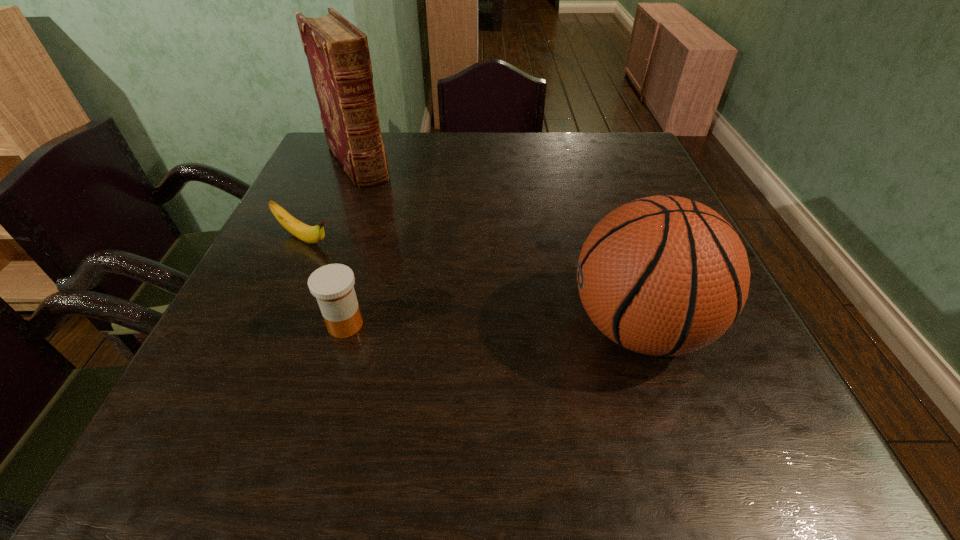
What are the coordinates of `vacant space located on the side where the inflation valve is located` in the screenshot? It's located at (447, 327).

I want to click on free point located on the spine side of the tallest object, so click(375, 196).

This screenshot has width=960, height=540. What are the coordinates of `free spot located 0.300m on the spine side of the tallest object` in the screenshot? It's located at (414, 249).

This screenshot has width=960, height=540. In order to click on free space located on the spine side of the tallest object in this screenshot , I will do `click(423, 263)`.

You are a GUI agent. You are given a task and a screenshot of the screen. Output one action in this format:
    pyautogui.click(x=<x>, y=<y>)
    Task: Click on the vacant space located at the stem of the shortest object
    
    Given the screenshot: What is the action you would take?
    pyautogui.click(x=367, y=266)

Find the location of `free region located 0.070m at the stem of the shortest object`. free region located 0.070m at the stem of the shortest object is located at coordinates tap(352, 259).

The image size is (960, 540). What are the coordinates of `vacant region located at the stem of the shortest object` in the screenshot? It's located at (356, 261).

Locate an element on the screen. This screenshot has height=540, width=960. object located at the far edge is located at coordinates (338, 56).

This screenshot has width=960, height=540. Identify the location of object present at the near edge. (663, 275).

Where is `hardback book that is at the left edge`? hardback book that is at the left edge is located at coordinates (338, 56).